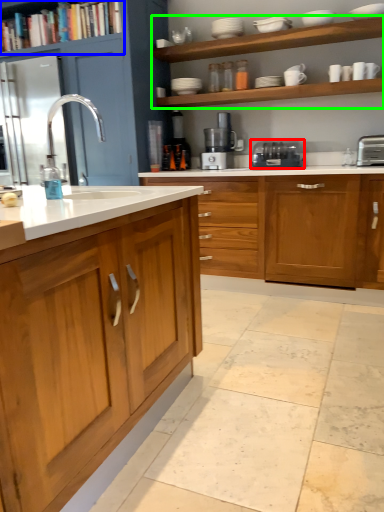
Question: Which object is the closest to the home appliance (highlighted by a red box)? Choose among these: shelf (highlighted by a blue box) or shelf (highlighted by a green box).

Choices:
 (A) shelf
 (B) shelf

Answer: (B)